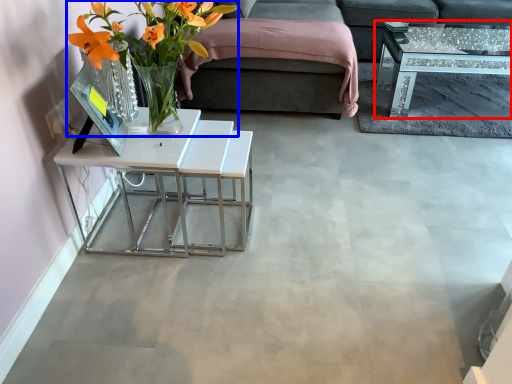
Question: Which object is further to the camera taking this photo, coffee table (highlighted by a red box) or floral arrangement (highlighted by a blue box)?

Choices:
 (A) coffee table
 (B) floral arrangement

Answer: (A)